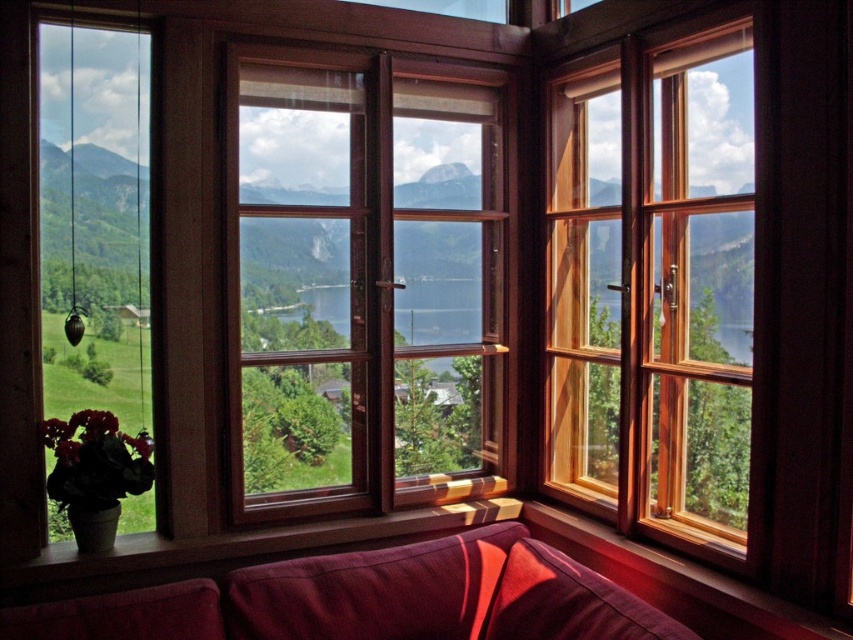
Does wooden window at center appear over velvet burgundy couch at lower center?

Yes, wooden window at center is above velvet burgundy couch at lower center.

What do you see at coordinates (364, 288) in the screenshot?
I see `wooden window at center` at bounding box center [364, 288].

Which is in front, point (467, 483) or point (351, 609)?

Point (351, 609)

Where is `wooden window at center`? wooden window at center is located at coordinates (364, 288).

I want to click on wooden window at upper right, so click(x=654, y=285).

Between wooden window at upper right and velvet burgundy couch at lower center, which one is positioned lower?

velvet burgundy couch at lower center is lower down.

Between point (671, 244) and point (341, 579), which one is positioned in front?

Point (341, 579)

What are the coordinates of `wooden window at upper right` in the screenshot? It's located at (654, 285).

Who is taller, wooden window at center or wooden window at upper right?

wooden window at upper right is taller.

Does wooden window at center appear under wooden window at upper right?

Correct, wooden window at center is located below wooden window at upper right.

The image size is (853, 640). Describe the element at coordinates (364, 288) in the screenshot. I see `wooden window at center` at that location.

The height and width of the screenshot is (640, 853). Find the location of `wooden window at center`. wooden window at center is located at coordinates tap(364, 288).